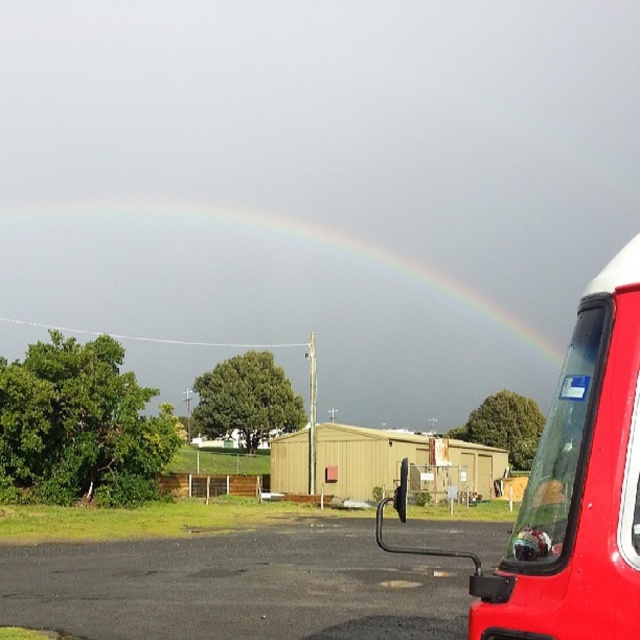
Question: Which point appears farthest from the camera in this image?

Choices:
 (A) (598, 445)
 (B) (157, 588)

Answer: (B)

Question: Which point is closer to the camera?

Choices:
 (A) shiny red truck at right
 (B) black asphalt parking lot at lower left
 (C) rainbow at upper center

Answer: (A)

Question: Can you confirm if black asphalt parking lot at lower left is positioned to the right of shiny red truck at right?

Choices:
 (A) yes
 (B) no

Answer: (B)

Question: Can you confirm if black asphalt parking lot at lower left is positioned above rainbow at upper center?

Choices:
 (A) yes
 (B) no

Answer: (B)

Question: Can you confirm if shiny red truck at right is positioned to the right of rainbow at upper center?

Choices:
 (A) yes
 (B) no

Answer: (A)

Question: Which point is farther to the camera?

Choices:
 (A) coord(628,596)
 (B) coord(145,339)
 (C) coord(380,570)

Answer: (B)